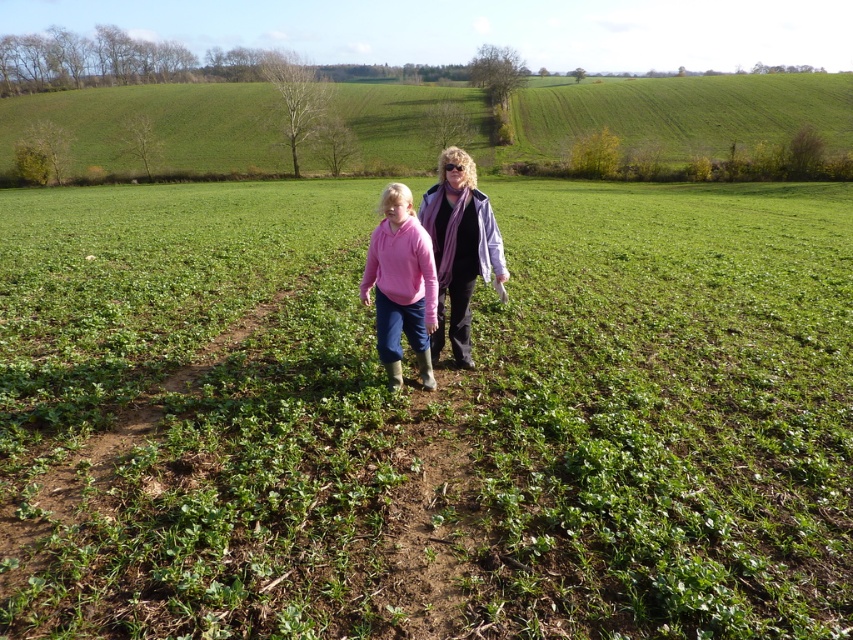
Question: Does matte purple scarf at center appear on the right side of pink fleece at center?

Choices:
 (A) no
 (B) yes

Answer: (B)

Question: Does green grass at center have a larger size compared to pink fleece at center?

Choices:
 (A) no
 (B) yes

Answer: (B)

Question: Which object is positioned farthest from the green grass at center?

Choices:
 (A) pink fleece at center
 (B) matte purple scarf at center

Answer: (B)

Question: Which point is closer to the camera?

Choices:
 (A) click(x=463, y=298)
 (B) click(x=431, y=387)
 (C) click(x=222, y=257)

Answer: (B)

Question: From the image, what is the correct spatial relationship of green grass at center in relation to matte purple scarf at center?

Choices:
 (A) below
 (B) above

Answer: (B)

Question: Among these points, which one is nearest to the camera?

Choices:
 (A) (416, 356)
 (B) (445, 278)
 (C) (360, 497)

Answer: (C)